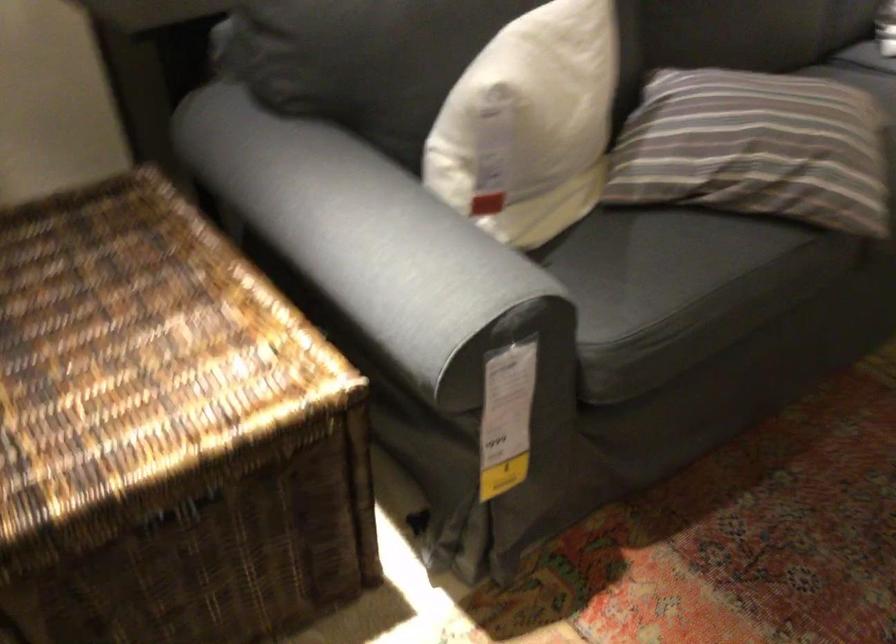
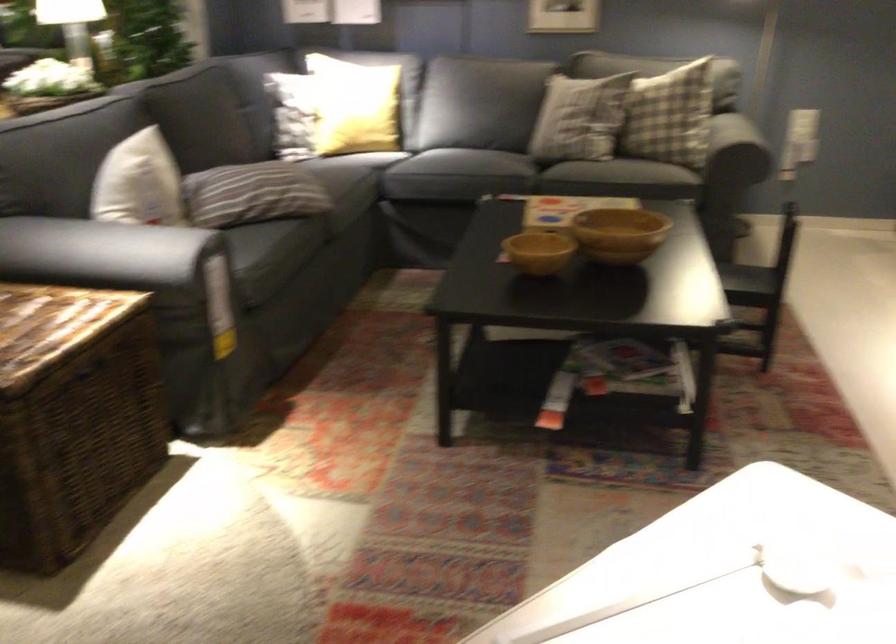
The point at [744,164] is marked in the first image. Where is the corresponding point in the second image?

(261, 194)